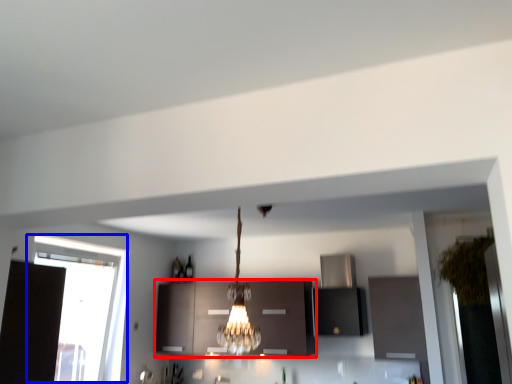
Question: Among these objects, which one is nearest to the camera, cabinetry (highlighted by a red box) or window (highlighted by a blue box)?

Choices:
 (A) cabinetry
 (B) window

Answer: (B)